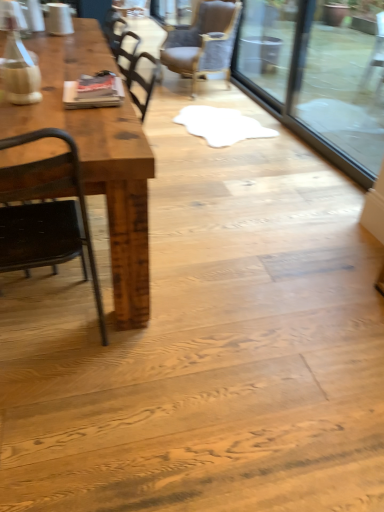
Where is `rustic wood table at left`? This screenshot has height=512, width=384. rustic wood table at left is located at coordinates (98, 156).

Where is `transparent glass door at upper right`? The height and width of the screenshot is (512, 384). transparent glass door at upper right is located at coordinates (318, 75).

From a real-world perspective, which object rests below the other?

rustic wood table at left.

Can you confirm if rustic wood table at left is thinner than transparent glass door at upper right?

No.

Does point (135, 233) come farther from viewer compared to point (322, 126)?

No, it is not.

Find the location of a particular element. This screenshot has width=384, height=512. glass door located above the black metal chair at left, the first chair when ordered from front to back (from a real-world perspective) is located at coordinates (318, 75).

From a real-world perspective, does black metal chair at left, the first chair when ordered from front to back, stand above transparent glass door at upper right?

No.

Considering the relative sizes of black metal chair at left, the 2th chair from the top, and transparent glass door at upper right in the image provided, is black metal chair at left, the 2th chair from the top, thinner than transparent glass door at upper right?

No, black metal chair at left, the 2th chair from the top, is not thinner than transparent glass door at upper right.

Which is more to the right, black metal chair at left, the 2th chair from the top, or transparent glass door at upper right?

From the viewer's perspective, transparent glass door at upper right appears more on the right side.

From the image's perspective, does brown leather chair at upper center, placed as the second chair when sorted from bottom to top, appear lower than transparent glass door at upper right?

No, from the image's perspective, brown leather chair at upper center, placed as the second chair when sorted from bottom to top, is not below transparent glass door at upper right.

Does brown leather chair at upper center, acting as the second chair starting from the front, come behind transparent glass door at upper right?

Yes, brown leather chair at upper center, acting as the second chair starting from the front, is behind transparent glass door at upper right.

Is brown leather chair at upper center, acting as the second chair starting from the front, next to transparent glass door at upper right?

brown leather chair at upper center, acting as the second chair starting from the front, is not next to transparent glass door at upper right, and they're not touching.

Is transparent glass door at upper right next to rustic wood table at left and touching it?

No, transparent glass door at upper right is not with rustic wood table at left.

Is transparent glass door at upper right positioned with its back to rustic wood table at left?

transparent glass door at upper right is not turned away from rustic wood table at left.

From the image's perspective, is transparent glass door at upper right above or below rustic wood table at left?

From the image's perspective, transparent glass door at upper right appears above rustic wood table at left.

Does transparent glass door at upper right have a greater width compared to rustic wood table at left?

In fact, transparent glass door at upper right might be narrower than rustic wood table at left.

Looking at this image, does rustic wood table at left have a lesser width compared to black metal chair at left, the 2th chair from the top?

No.

Can you confirm if rustic wood table at left is bigger than black metal chair at left, which ranks as the 2th chair in right-to-left order?

Correct, rustic wood table at left is larger in size than black metal chair at left, which ranks as the 2th chair in right-to-left order.

Is rustic wood table at left oriented away from black metal chair at left, the 2th chair from the top?

No.

From the image's perspective, is black metal chair at left, which ranks as the 2th chair in right-to-left order, on top of brown leather chair at upper center, acting as the 1th chair starting from the top?

Actually, black metal chair at left, which ranks as the 2th chair in right-to-left order, appears below brown leather chair at upper center, acting as the 1th chair starting from the top, in the image.

Would you say brown leather chair at upper center, placed as the second chair when sorted from bottom to top, is part of black metal chair at left, which ranks as the 2th chair in right-to-left order,'s contents?

No, brown leather chair at upper center, placed as the second chair when sorted from bottom to top, is not a part of black metal chair at left, which ranks as the 2th chair in right-to-left order.

Considering the relative positions of black metal chair at left, the 2th chair from the top, and brown leather chair at upper center, placed as the second chair when sorted from bottom to top, in the image provided, is black metal chair at left, the 2th chair from the top, to the right of brown leather chair at upper center, placed as the second chair when sorted from bottom to top, from the viewer's perspective?

Incorrect, black metal chair at left, the 2th chair from the top, is not on the right side of brown leather chair at upper center, placed as the second chair when sorted from bottom to top.

Considering their positions, is black metal chair at left, which is counted as the first chair, starting from the bottom, located in front of or behind brown leather chair at upper center, placed as the second chair when sorted from bottom to top?

Visually, black metal chair at left, which is counted as the first chair, starting from the bottom, is located in front of brown leather chair at upper center, placed as the second chair when sorted from bottom to top.

Between transparent glass door at upper right and brown leather chair at upper center, which is the second chair from left to right, which one has less height?

brown leather chair at upper center, which is the second chair from left to right.

Is transparent glass door at upper right further to camera compared to brown leather chair at upper center, acting as the 1th chair starting from the top?

No, it is not.

From a real-world perspective, is transparent glass door at upper right physically located above or below brown leather chair at upper center, placed as the second chair when sorted from bottom to top?

transparent glass door at upper right is situated higher than brown leather chair at upper center, placed as the second chair when sorted from bottom to top, in the real world.

Can you confirm if transparent glass door at upper right is positioned to the left of brown leather chair at upper center, arranged as the 1th chair when viewed from the back?

No, transparent glass door at upper right is not to the left of brown leather chair at upper center, arranged as the 1th chair when viewed from the back.

Image resolution: width=384 pixels, height=512 pixels. What are the coordinates of `table located underneath the transparent glass door at upper right (from a real-world perspective)` in the screenshot? It's located at (98, 156).

Locate an element on the screen. glass door above the black metal chair at left, the second chair viewed from the back (from a real-world perspective) is located at coordinates (318, 75).

Which object lies nearer to the anchor point brown leather chair at upper center, arranged as the 1th chair when viewed from the back, black metal chair at left, the first chair when ordered from front to back, or transparent glass door at upper right?

transparent glass door at upper right lies closer to brown leather chair at upper center, arranged as the 1th chair when viewed from the back, than the other object.

From the image, which object appears to be farther from black metal chair at left, the 2th chair from the top, transparent glass door at upper right or brown leather chair at upper center, acting as the 1th chair starting from the top?

Based on the image, brown leather chair at upper center, acting as the 1th chair starting from the top, appears to be further to black metal chair at left, the 2th chair from the top.

When comparing their distances from black metal chair at left, the first chair when ordered from front to back, does brown leather chair at upper center, which is the second chair from left to right, or rustic wood table at left seem further?

Based on the image, brown leather chair at upper center, which is the second chair from left to right, appears to be further to black metal chair at left, the first chair when ordered from front to back.

Looking at the image, which one is located further to brown leather chair at upper center, positioned as the 1th chair in right-to-left order, transparent glass door at upper right or black metal chair at left, which ranks as the 2th chair in right-to-left order?

black metal chair at left, which ranks as the 2th chair in right-to-left order, is further to brown leather chair at upper center, positioned as the 1th chair in right-to-left order.

When comparing their distances from transparent glass door at upper right, does rustic wood table at left or brown leather chair at upper center, acting as the second chair starting from the front, seem further?

Among the two, rustic wood table at left is located further to transparent glass door at upper right.

Looking at the image, which one is located further to brown leather chair at upper center, which is the second chair from left to right, rustic wood table at left or black metal chair at left, the first chair when ordered from front to back?

black metal chair at left, the first chair when ordered from front to back.

Looking at the image, which one is located closer to rustic wood table at left, brown leather chair at upper center, which is the second chair from left to right, or transparent glass door at upper right?

Among the two, brown leather chair at upper center, which is the second chair from left to right, is located nearer to rustic wood table at left.

Considering their positions, is black metal chair at left, the 1th chair viewed from the left, positioned closer to rustic wood table at left than transparent glass door at upper right?

Among the two, black metal chair at left, the 1th chair viewed from the left, is located nearer to rustic wood table at left.

You are a GUI agent. You are given a task and a screenshot of the screen. Output one action in this format:
    pyautogui.click(x=<x>, y=<y>)
    Task: Click on the glass door between black metal chair at left, the 1th chair viewed from the left, and brown leather chair at upper center, which is the second chair from left to right, along the z-axis
    
    Given the screenshot: What is the action you would take?
    pyautogui.click(x=318, y=75)

Locate an element on the screen. Image resolution: width=384 pixels, height=512 pixels. table between black metal chair at left, which ranks as the 2th chair in right-to-left order, and brown leather chair at upper center, which is the second chair from left to right, in the front-back direction is located at coordinates (98, 156).

Identify the location of glass door between rustic wood table at left and brown leather chair at upper center, arranged as the 1th chair when viewed from the back, from front to back. This screenshot has width=384, height=512. (318, 75).